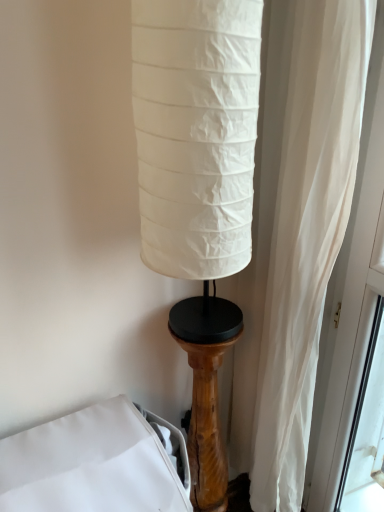
Question: From a real-world perspective, is white fabric bed at lower left above or below wooden pedestal at lower right?

Choices:
 (A) above
 (B) below

Answer: (B)

Question: Do you think white fabric bed at lower left is within wooden pedestal at lower right, or outside of it?

Choices:
 (A) outside
 (B) inside

Answer: (A)

Question: Considering the positions of point (59, 497) and point (205, 406), is point (59, 497) closer or farther from the camera than point (205, 406)?

Choices:
 (A) closer
 (B) farther

Answer: (A)

Question: Looking at the image, does wooden pedestal at lower right seem bigger or smaller compared to white fabric bed at lower left?

Choices:
 (A) big
 (B) small

Answer: (B)

Question: From the image's perspective, relative to white fabric bed at lower left, is wooden pedestal at lower right above or below?

Choices:
 (A) below
 (B) above

Answer: (B)

Question: From a real-world perspective, is wooden pedestal at lower right above or below white fabric bed at lower left?

Choices:
 (A) below
 (B) above

Answer: (B)

Question: From their relative heights in the image, would you say wooden pedestal at lower right is taller or shorter than white fabric bed at lower left?

Choices:
 (A) short
 (B) tall

Answer: (B)